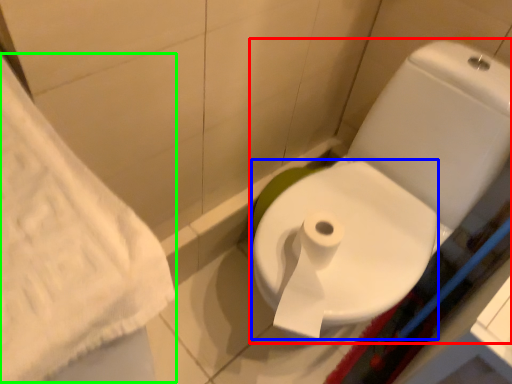
Question: Based on their relative distances, which object is farther from toilet (highlighted by a red box)? Choose from bidet (highlighted by a blue box) and bath towel (highlighted by a green box).

Choices:
 (A) bidet
 (B) bath towel

Answer: (B)